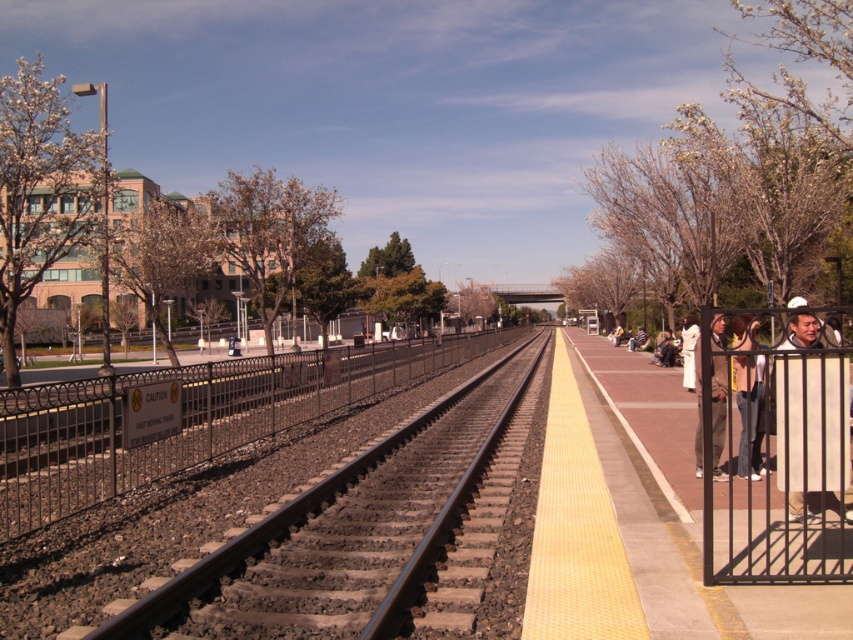
You are a maintenance worker standing on the platform and need to reach the smooth steel tracks at center from the denim pants at right. Is the distance between them sufficient for you to walk directly to the tracks without needing to move any obstacles?

The smooth steel tracks at center is 6.02 meters from denim pants at right, so yes, the distance is sufficient for you to walk directly to the tracks without needing to move any obstacles.

You are a pedestrian standing on the platform and see both the black metal fence at right and the white fabric jacket at right. Which object is nearer to you?

The black metal fence at right is closer to the viewer than the white fabric jacket at right.

You are standing on the train station platform and want to locate the black metal fence at right. According to the coordinates provided, where exactly should you look?

The black metal fence at right is located at the 2D coordinates point of [779,449].